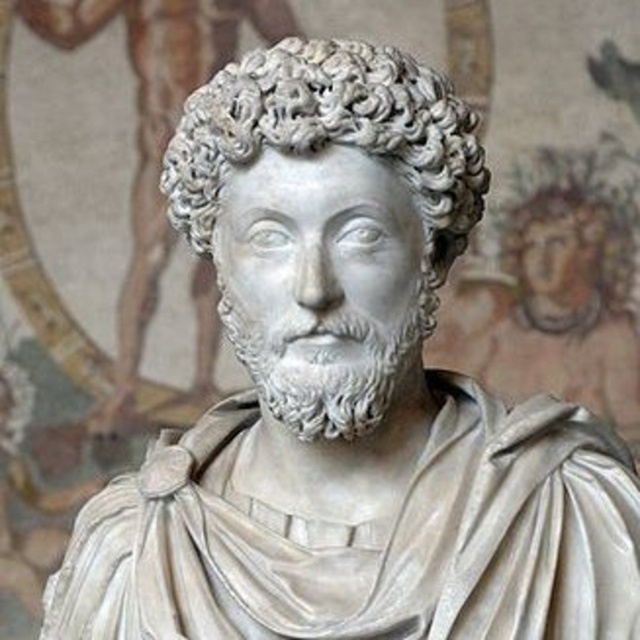
You are an art curator examining two white marble heads in a gallery. The first is the white marble head at center, and the second is the white marble head at upper right. Based on their sizes, which one would require more space for proper display?

The white marble head at center requires more space for proper display because it is larger in size compared to the white marble head at upper right.

You are an art conservator working in a gallery. You need to move the white marble head at center and the white marble head at upper right to a new exhibition space. The distance between them must be maintained as per the original placement. What is the exact distance you should keep between them?

The exact distance between the white marble head at center and the white marble head at upper right should be maintained at 6.41 feet to preserve their original placement.